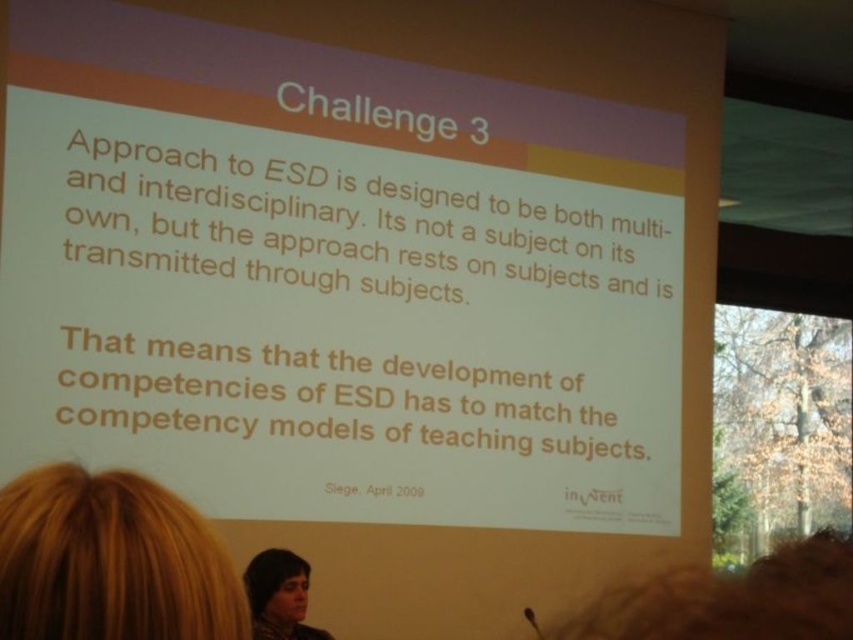
Is blonde hair at lower left positioned behind dark brown hair at lower center?

No, it is not.

Is point (154, 605) closer to viewer compared to point (248, 561)?

Yes, point (154, 605) is in front of point (248, 561).

Between point (70, 620) and point (273, 554), which one is positioned behind?

Positioned behind is point (273, 554).

The width and height of the screenshot is (853, 640). Find the location of `blonde hair at lower left`. blonde hair at lower left is located at coordinates (109, 561).